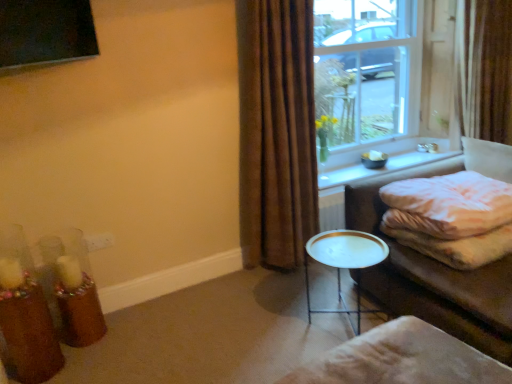
What is the approximate width of clear glass window at upper right?

6.54 inches.

In order to click on translucent glass candle holder at lower left, arranged as the second candle holder when viewed from the front in this screenshot , I will do `click(46, 302)`.

Where is `white textured blanket at right`? white textured blanket at right is located at coordinates (448, 205).

This screenshot has width=512, height=384. In order to click on white glossy side table at center in this screenshot , I will do (344, 261).

What are the coordinates of `brown velvet curtain at center, marked as the second curtain in a back-to-front arrangement` in the screenshot? It's located at (276, 132).

Where is `white glossy window sill at upper right`? white glossy window sill at upper right is located at coordinates (380, 169).

The width and height of the screenshot is (512, 384). I want to click on clear glass window at upper right, so click(386, 82).

Considering the relative sizes of white glossy window sill at upper right and brown velvet curtain at center, positioned as the 1th curtain in left-to-right order, in the image provided, is white glossy window sill at upper right bigger than brown velvet curtain at center, positioned as the 1th curtain in left-to-right order,?

Actually, white glossy window sill at upper right might be smaller than brown velvet curtain at center, positioned as the 1th curtain in left-to-right order.

Is white glossy window sill at upper right oriented towards brown velvet curtain at center, placed as the second curtain when sorted from right to left?

No, white glossy window sill at upper right is not turned towards brown velvet curtain at center, placed as the second curtain when sorted from right to left.

Locate an element on the screen. the 2nd curtain in front of the white glossy window sill at upper right, starting your count from the anchor is located at coordinates (276, 132).

Image resolution: width=512 pixels, height=384 pixels. I want to click on curtain that is the 2nd one when counting rightward from the translucent glass candle holder at lower left, the 1th candle holder from the front, so click(x=484, y=68).

Would you say brown fabric curtain at right, which is the first curtain from right to left, is part of translucent glass candle holder at lower left, the 1th candle holder from the front,'s contents?

Definitely not — brown fabric curtain at right, which is the first curtain from right to left, is not inside translucent glass candle holder at lower left, the 1th candle holder from the front.

From the picture: Which object is positioned more to the left, translucent glass candle holder at lower left, the 2th candle holder viewed from the back, or brown fabric curtain at right, the 2th curtain viewed from the left?

translucent glass candle holder at lower left, the 2th candle holder viewed from the back, is more to the left.

What's the angular difference between translucent glass candle holder at lower left, the 1th candle holder from the front, and brown fabric curtain at right, which is counted as the 1th curtain, starting from the back,'s facing directions?

88.7 degrees.

Between white glossy side table at center and white textured blanket at right, which one appears on the right side from the viewer's perspective?

From the viewer's perspective, white textured blanket at right appears more on the right side.

Can you confirm if white glossy side table at center is thinner than white textured blanket at right?

Indeed, white glossy side table at center has a lesser width compared to white textured blanket at right.

From the image's perspective, between white glossy side table at center and white textured blanket at right, which one is located above?

From the image's view, white textured blanket at right is above.

Between white glossy window sill at upper right and white textured blanket at right, which one is positioned in front?

Positioned in front is white textured blanket at right.

Is white glossy window sill at upper right completely or partially outside of white textured blanket at right?

That's correct, white glossy window sill at upper right is outside of white textured blanket at right.

Who is shorter, white glossy window sill at upper right or white textured blanket at right?

white glossy window sill at upper right is shorter.

From the image's perspective, does white glossy window sill at upper right appear higher than white textured blanket at right?

Yes.

Locate an element on the screen. The height and width of the screenshot is (384, 512). window that is above the white glossy side table at center (from the image's perspective) is located at coordinates (386, 82).

Is clear glass window at upper right to the left or to the right of white glossy side table at center in the image?

In the image, clear glass window at upper right appears on the right side of white glossy side table at center.

How many degrees apart are the facing directions of clear glass window at upper right and white glossy side table at center?

The facing directions of clear glass window at upper right and white glossy side table at center are 90 degrees apart.

From the image's perspective, is clear glass window at upper right under white glossy side table at center?

Actually, clear glass window at upper right appears above white glossy side table at center in the image.

Does beige fabric footrest at lower right have a larger size compared to translucent glass candle holder at lower left, the first candle holder in the back-to-front sequence?

Correct, beige fabric footrest at lower right is larger in size than translucent glass candle holder at lower left, the first candle holder in the back-to-front sequence.

Considering the relative positions of beige fabric footrest at lower right and translucent glass candle holder at lower left, arranged as the second candle holder when viewed from the front, in the image provided, is beige fabric footrest at lower right to the left of translucent glass candle holder at lower left, arranged as the second candle holder when viewed from the front, from the viewer's perspective?

No, beige fabric footrest at lower right is not to the left of translucent glass candle holder at lower left, arranged as the second candle holder when viewed from the front.

How many degrees apart are the facing directions of beige fabric footrest at lower right and translucent glass candle holder at lower left, arranged as the second candle holder when viewed from the front?

They differ by 172 degrees in their facing directions.

From the image's perspective, starting from the beige fabric footrest at lower right, which candle holder is the 2nd one above? Please provide its 2D coordinates.

[(46, 302)]

Which is less distant, (36, 281) or (342, 144)?

Point (36, 281).

Would you say translucent glass candle holder at lower left, arranged as the second candle holder when viewed from the front, contains clear glass window at upper right?

Actually, clear glass window at upper right is outside translucent glass candle holder at lower left, arranged as the second candle holder when viewed from the front.

Is translucent glass candle holder at lower left, the first candle holder in the back-to-front sequence, oriented away from clear glass window at upper right?

That's not correct — translucent glass candle holder at lower left, the first candle holder in the back-to-front sequence, is not looking away from clear glass window at upper right.

At what (x,y) coordinates should I click in order to perform the action: click on window sill to the right of brown velvet curtain at center, marked as the second curtain in a back-to-front arrangement. Please return your answer as a coordinate pair (x, y). The height and width of the screenshot is (384, 512). Looking at the image, I should click on [x=380, y=169].

Where is `curtain that is the 2nd one when counting upward from the translucent glass candle holder at lower left, the 1th candle holder from the front (from the image's perspective)`? Image resolution: width=512 pixels, height=384 pixels. curtain that is the 2nd one when counting upward from the translucent glass candle holder at lower left, the 1th candle holder from the front (from the image's perspective) is located at coordinates (484, 68).

Estimate the real-world distances between objects in this image. Which object is further from brown velvet curtain at center, placed as the second curtain when sorted from right to left, translucent glass candle holder at lower left, arranged as the second candle holder when viewed from the front, or beige fabric footrest at lower right?

Based on the image, beige fabric footrest at lower right appears to be further to brown velvet curtain at center, placed as the second curtain when sorted from right to left.

Based on their spatial positions, is white glossy side table at center or white textured blanket at right further from brown velvet curtain at center, positioned as the 1th curtain in left-to-right order?

Among the two, white textured blanket at right is located further to brown velvet curtain at center, positioned as the 1th curtain in left-to-right order.

Based on their spatial positions, is white glossy window sill at upper right or white textured blanket at right closer to white glossy side table at center?

Based on the image, white textured blanket at right appears to be nearer to white glossy side table at center.

Estimate the real-world distances between objects in this image. Which object is closer to translucent glass candle holder at lower left, the 2th candle holder viewed from the back, clear glass window at upper right or white glossy window sill at upper right?

white glossy window sill at upper right lies closer to translucent glass candle holder at lower left, the 2th candle holder viewed from the back, than the other object.

When comparing their distances from beige fabric footrest at lower right, does translucent glass candle holder at lower left, the first candle holder in the back-to-front sequence, or white glossy window sill at upper right seem further?

translucent glass candle holder at lower left, the first candle holder in the back-to-front sequence, lies further to beige fabric footrest at lower right than the other object.

Based on their spatial positions, is translucent glass candle holder at lower left, the first candle holder in the back-to-front sequence, or white glossy window sill at upper right further from white textured blanket at right?

translucent glass candle holder at lower left, the first candle holder in the back-to-front sequence, is positioned further to the anchor white textured blanket at right.

Which object lies nearer to the anchor point white textured blanket at right, translucent glass candle holder at lower left, the first candle holder in the back-to-front sequence, or brown fabric curtain at right, the 2th curtain viewed from the left?

brown fabric curtain at right, the 2th curtain viewed from the left.

Looking at this image, from the image, which object appears to be farther from beige fabric footrest at lower right, white textured blanket at right or translucent glass candle holder at lower left, the 1th candle holder from the front?

translucent glass candle holder at lower left, the 1th candle holder from the front, is positioned further to the anchor beige fabric footrest at lower right.

Locate an element on the screen. This screenshot has width=512, height=384. table situated between translucent glass candle holder at lower left, the 2th candle holder viewed from the back, and white textured blanket at right from left to right is located at coordinates pos(344,261).

Identify the location of window between translucent glass candle holder at lower left, the 2th candle holder viewed from the back, and white glossy window sill at upper right. (386, 82).

What are the coordinates of `window between translucent glass candle holder at lower left, arranged as the second candle holder when viewed from the front, and brown fabric curtain at right, which is counted as the 1th curtain, starting from the back, in the horizontal direction` in the screenshot? It's located at (386, 82).

Locate an element on the screen. The image size is (512, 384). table located between beige fabric footrest at lower right and clear glass window at upper right in the depth direction is located at coordinates (344, 261).